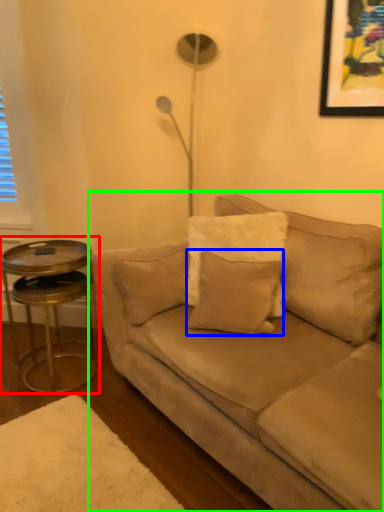
Question: Which is farther away from table (highlighted by a red box)? pillow (highlighted by a blue box) or studio couch (highlighted by a green box)?

Choices:
 (A) pillow
 (B) studio couch

Answer: (A)